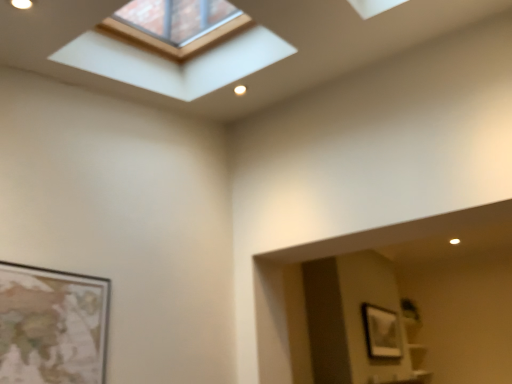
Question: Considering the positions of clear glass window at upper center and matte silver picture frame at upper right in the image, is clear glass window at upper center taller or shorter than matte silver picture frame at upper right?

Choices:
 (A) tall
 (B) short

Answer: (A)

Question: Based on their positions, is clear glass window at upper center located to the left or right of matte silver picture frame at upper right?

Choices:
 (A) right
 (B) left

Answer: (B)

Question: Do you think clear glass window at upper center is within matte silver picture frame at upper right, or outside of it?

Choices:
 (A) inside
 (B) outside

Answer: (B)

Question: From a real-world perspective, is matte silver picture frame at upper right positioned above or below clear glass window at upper center?

Choices:
 (A) below
 (B) above

Answer: (A)

Question: Considering the relative positions of matte silver picture frame at upper right and clear glass window at upper center in the image provided, is matte silver picture frame at upper right to the left or to the right of clear glass window at upper center?

Choices:
 (A) right
 (B) left

Answer: (A)

Question: Is matte silver picture frame at upper right in front of or behind clear glass window at upper center in the image?

Choices:
 (A) behind
 (B) front

Answer: (A)

Question: From the image's perspective, is matte silver picture frame at upper right above or below clear glass window at upper center?

Choices:
 (A) above
 (B) below

Answer: (B)